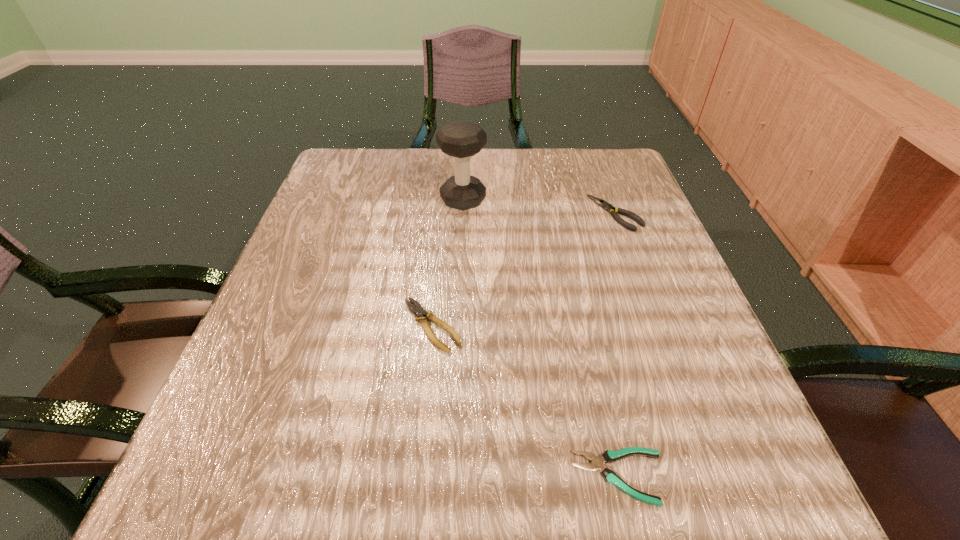
Identify the location of dumbbell. (461, 139).

The image size is (960, 540). I want to click on the rightmost pliers, so click(x=605, y=205).

The image size is (960, 540). What are the coordinates of `the tallest pliers` in the screenshot? It's located at (605, 205).

This screenshot has height=540, width=960. What are the coordinates of `the second farthest pliers` in the screenshot? It's located at (419, 311).

This screenshot has height=540, width=960. Identify the location of the third farthest object. (419, 311).

This screenshot has height=540, width=960. In order to click on the shortest object in this screenshot , I will do `click(597, 463)`.

Identify the location of the nearest pliers. This screenshot has width=960, height=540. (597, 463).

Find the location of a particular element. The image size is (960, 540). vacant area situated 0.230m on the front of the dumbbell is located at coordinates (459, 289).

Where is `free spot located on the front of the rightmost object`? The height and width of the screenshot is (540, 960). free spot located on the front of the rightmost object is located at coordinates (682, 392).

Locate an element on the screen. Image resolution: width=960 pixels, height=540 pixels. vacant area located on the front of the second nearest pliers is located at coordinates (416, 488).